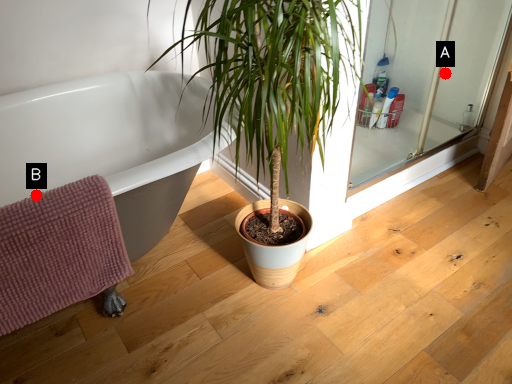
Question: Two points are circled on the image, labeled by A and B beside each circle. Which point is closer to the camera taking this photo?

Choices:
 (A) A is closer
 (B) B is closer

Answer: (B)